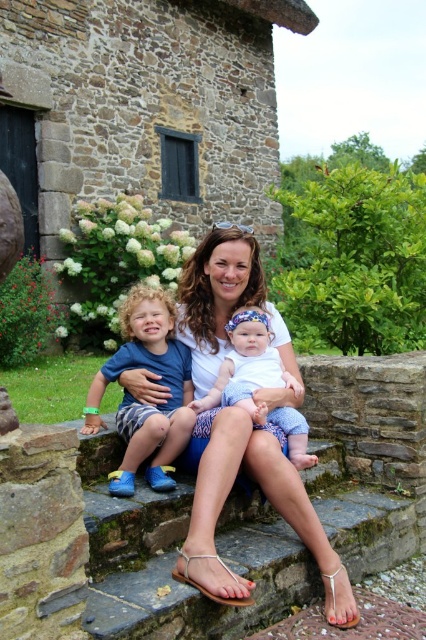
You are a photographer trying to capture the baby in the white outfit with a colorful headband. The baby is currently at the point with coordinates (265, 497). You want to adjust your camera to focus on the baby. According to the scene description, where exactly is the baby located?

The baby is located at the white fabric shirt at center, which corresponds to the coordinates point (265, 497).

You are a photographer setting up for a family portrait. You have two white shirts, the white fabric shirt at center and the white cotton shirt at center. The distance between them is crucial for the lighting setup. Can you confirm if the shirts are positioned at least 30 inches apart?

The white fabric shirt at center is 35.33 inches away from the white cotton shirt at center, so yes, they are positioned more than 30 inches apart, meeting the lighting requirement.